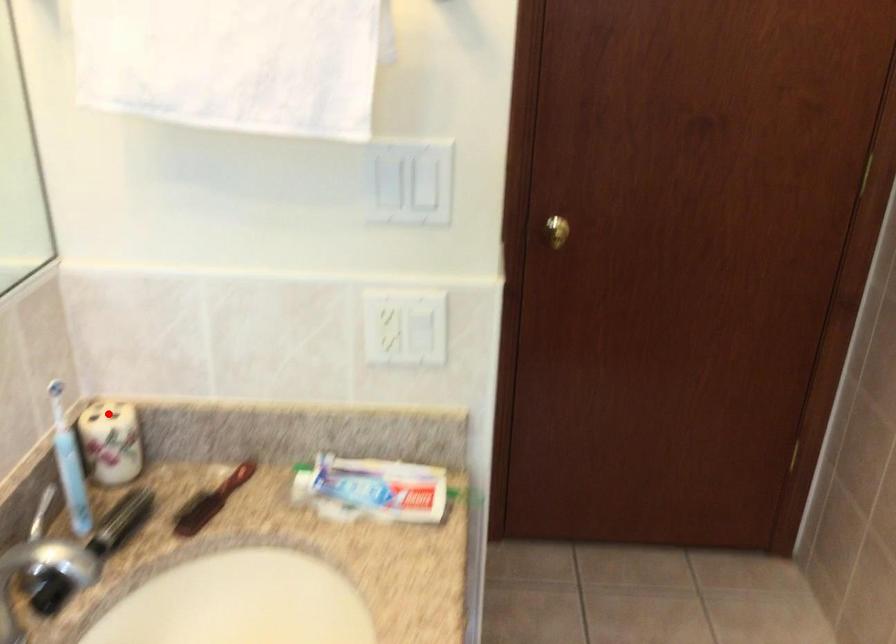
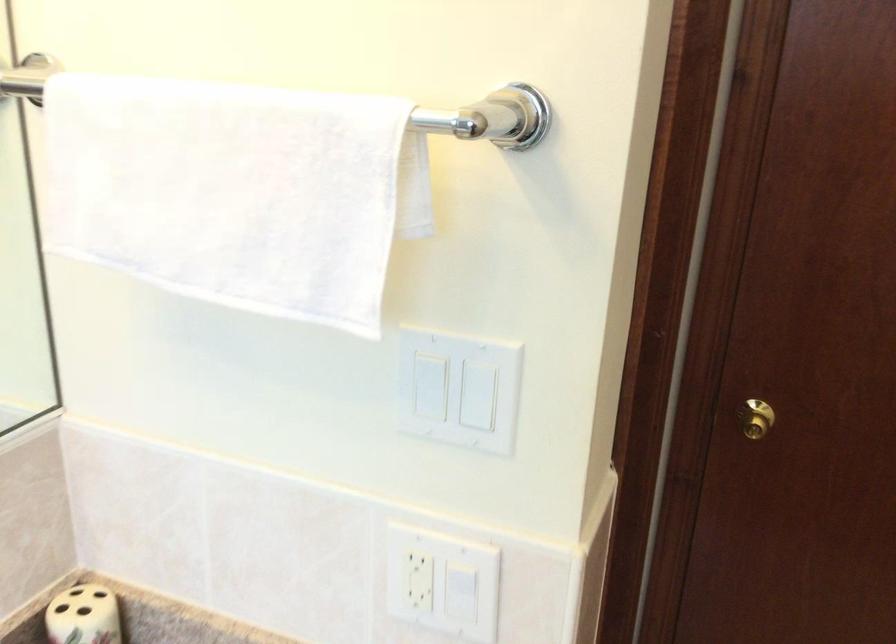
The point at the highlighted location is marked in the first image. Where is the corresponding point in the second image?

(83, 616)